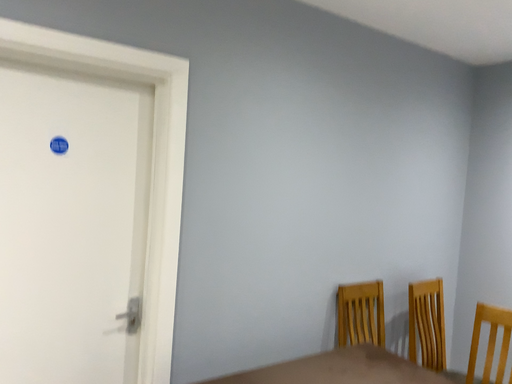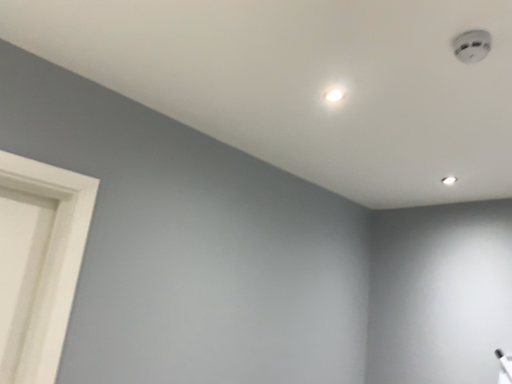
Question: Which way did the camera rotate in the video?

Choices:
 (A) rotated right
 (B) rotated left

Answer: (A)